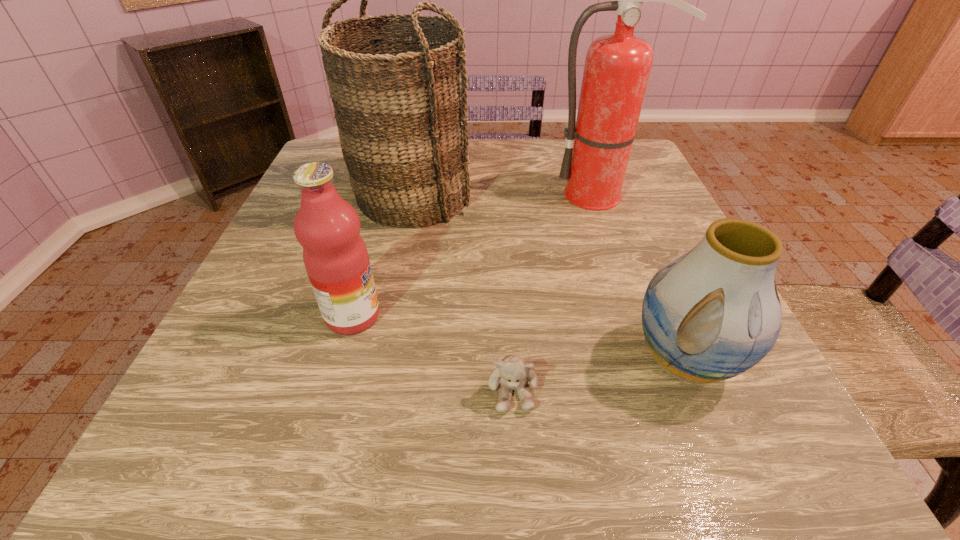
This screenshot has height=540, width=960. I want to click on fire extinguisher, so (x=617, y=67).

This screenshot has height=540, width=960. I want to click on basket, so click(400, 105).

Where is `fruit juice`? fruit juice is located at coordinates (335, 256).

Find the location of a particular element. The width and height of the screenshot is (960, 540). vase is located at coordinates (714, 312).

Where is `teddy bear`? Image resolution: width=960 pixels, height=540 pixels. teddy bear is located at coordinates [x=511, y=373].

Where is `the shortest object`? This screenshot has height=540, width=960. the shortest object is located at coordinates (511, 373).

Where is `free space located with the handle and hose on the fire extinguisher`? The height and width of the screenshot is (540, 960). free space located with the handle and hose on the fire extinguisher is located at coordinates (654, 342).

At what (x,y) coordinates should I click in order to perform the action: click on vacant space located 0.230m on the right of the basket. Please return your answer as a coordinate pair (x, y). Image resolution: width=960 pixels, height=540 pixels. Looking at the image, I should click on (567, 197).

In order to click on free space located 0.250m on the label of the fruit juice in this screenshot , I will do `click(523, 316)`.

This screenshot has width=960, height=540. Find the location of `free space located on the left of the second shortest object`. free space located on the left of the second shortest object is located at coordinates (435, 360).